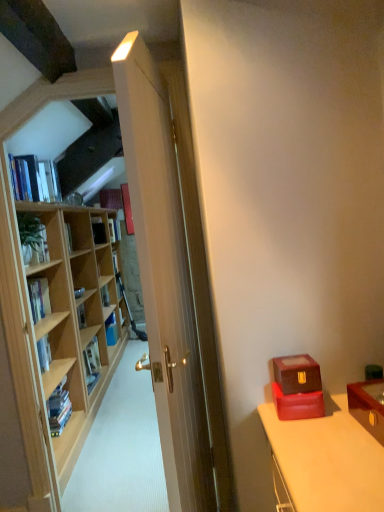
What is the approximate width of hardcover book at center, the second book when ordered from back to front?

hardcover book at center, the second book when ordered from back to front, is 5.29 inches in width.

In order to face wooden chest at right, should I rotate leftwards or rightwards?

You should rotate right by 26.894 degrees.

Describe the element at coordinates (297, 374) in the screenshot. I see `brown leather box at right, which ranks as the 2th box in bottom-to-top order` at that location.

What do you see at coordinates (32, 238) in the screenshot? The image size is (384, 512). I see `green leafy plant at left` at bounding box center [32, 238].

Find the location of a particular element. This screenshot has width=384, height=512. hardcover book at left, arranged as the sixth book when viewed from the back is located at coordinates (79, 292).

Considering the positions of point (30, 88) and point (75, 294), is point (30, 88) closer or farther from the camera than point (75, 294)?

Point (30, 88) is closer to the camera than point (75, 294).

Considering the relative sizes of light wood shelf at left and hardcover book at left, arranged as the sixth book when viewed from the back, in the image provided, is light wood shelf at left smaller than hardcover book at left, arranged as the sixth book when viewed from the back,?

Incorrect, light wood shelf at left is not smaller in size than hardcover book at left, arranged as the sixth book when viewed from the back.

Measure the distance between light wood shelf at left and hardcover book at left, which appears as the fifth book when viewed from the front.

The distance of light wood shelf at left from hardcover book at left, which appears as the fifth book when viewed from the front, is 33.32 inches.

In terms of width, does green leafy plant at left look wider or thinner when compared to hardcover book at left, arranged as the sixth book when viewed from the back?

In the image, green leafy plant at left appears to be wider than hardcover book at left, arranged as the sixth book when viewed from the back.

Is green leafy plant at left turned away from hardcover book at left, which appears as the fifth book when viewed from the front?

No, green leafy plant at left's orientation is not away from hardcover book at left, which appears as the fifth book when viewed from the front.

Is green leafy plant at left in front of hardcover book at left, which appears as the fifth book when viewed from the front?

Yes, green leafy plant at left is closer to the camera.

Is hardcover book at left, which is the second book in front-to-back order, not inside hardcover book at left, the third book viewed from the back?

Absolutely, hardcover book at left, which is the second book in front-to-back order, is external to hardcover book at left, the third book viewed from the back.

Is point (31, 298) farther from camera compared to point (98, 228)?

No, (31, 298) is in front of (98, 228).

Between hardcover book at left, placed as the ninth book when sorted from back to front, and hardcover book at left, the third book viewed from the back, which one appears on the right side from the viewer's perspective?

Positioned to the right is hardcover book at left, the third book viewed from the back.

Considering the relative positions of wooden chest at right and hardcover book at left, acting as the 8th book starting from the front, in the image provided, is wooden chest at right to the right of hardcover book at left, acting as the 8th book starting from the front, from the viewer's perspective?

Yes, wooden chest at right is to the right of hardcover book at left, acting as the 8th book starting from the front.

Which of these two, wooden chest at right or hardcover book at left, acting as the 8th book starting from the front, is smaller?

Smaller between the two is hardcover book at left, acting as the 8th book starting from the front.

Can you confirm if wooden chest at right is wider than hardcover book at left, the third book viewed from the back?

Indeed, wooden chest at right has a greater width compared to hardcover book at left, the third book viewed from the back.

Is point (360, 403) behind point (100, 240)?

No, it is in front of (100, 240).

Is matte brown box at right, the second box positioned from the top, spatially inside green matte plant at left, the 7th book in the back-to-front sequence, or outside of it?

matte brown box at right, the second box positioned from the top, is spatially situated outside green matte plant at left, the 7th book in the back-to-front sequence.

Considering the points (284, 403) and (39, 229), which point is behind, point (284, 403) or point (39, 229)?

Positioned behind is point (39, 229).

Is matte brown box at right, which is the first box from bottom to top, not near green matte plant at left, the 7th book in the back-to-front sequence?

matte brown box at right, which is the first box from bottom to top, is far away from green matte plant at left, the 7th book in the back-to-front sequence.

How far apart are matte brown box at right, the second box positioned from the top, and green matte plant at left, the 4th book from the front?

matte brown box at right, the second box positioned from the top, and green matte plant at left, the 4th book from the front, are 5.75 feet apart from each other.

I want to click on shelf directly beneath the wooden bookshelf at left, arranged as the 6th book when viewed from the front (from a real-world perspective), so click(50, 322).

In the scene shown: From a real-world perspective, who is located higher, wooden bookshelf at left, the fifth book when ordered from back to front, or light wood shelf at left?

wooden bookshelf at left, the fifth book when ordered from back to front.

Are wooden bookshelf at left, arranged as the 6th book when viewed from the front, and light wood shelf at left located far from each other?

No.

Consider the image. Between wooden bookshelf at left, the fifth book when ordered from back to front, and light wood shelf at left, which one has smaller size?

Smaller between the two is wooden bookshelf at left, the fifth book when ordered from back to front.

Is there a large distance between hardcover book at left, which is the 8th book from back to front, and wooden bookshelf at left, the fifth book when ordered from back to front?

hardcover book at left, which is the 8th book from back to front, is positioned a significant distance from wooden bookshelf at left, the fifth book when ordered from back to front.

From the image's perspective, is hardcover book at left, which is the 8th book from back to front, located above or below wooden bookshelf at left, arranged as the 6th book when viewed from the front?

hardcover book at left, which is the 8th book from back to front, is situated lower than wooden bookshelf at left, arranged as the 6th book when viewed from the front, in the image.

Who is shorter, hardcover book at left, which is the 8th book from back to front, or wooden bookshelf at left, arranged as the 6th book when viewed from the front?

With less height is wooden bookshelf at left, arranged as the 6th book when viewed from the front.

Identify the location of the 1st book positioned above the light wood shelf at left (from the image's perspective). Image resolution: width=384 pixels, height=512 pixels. (79, 292).

From the green leafy plant at left, count 5th books backward and point to it. Please provide its 2D coordinates.

[(79, 292)]

Based on their spatial positions, is hardcover book at left, acting as the 8th book starting from the front, or blue glossy book at left, which ranks as the fourth book in back-to-front order, closer to light wood shelf at left?

The object closer to light wood shelf at left is blue glossy book at left, which ranks as the fourth book in back-to-front order.

Considering their positions, is white wooden door at center positioned further to hardcover book at left, placed as the ninth book when sorted from back to front, than hardcover book at left, arranged as the sixth book when viewed from the back?

Among the two, white wooden door at center is located further to hardcover book at left, placed as the ninth book when sorted from back to front.

Looking at the image, which one is located further to white wooden door at center, wooden bookshelf at left, arranged as the 6th book when viewed from the front, or blue glossy book at left, which is the seventh book from front to back?

Based on the image, blue glossy book at left, which is the seventh book from front to back, appears to be further to white wooden door at center.

When comparing their distances from blue glossy book at left, which ranks as the fourth book in back-to-front order, does wooden bookshelf at left, the fifth book when ordered from back to front, or light wood shelf at left seem closer?

The object closer to blue glossy book at left, which ranks as the fourth book in back-to-front order, is light wood shelf at left.

Looking at this image, based on their spatial positions, is green matte plant at left, the 7th book in the back-to-front sequence, or hardcover book at left, the third book viewed from the back, closer to hardcover book at left, placed as the ninth book when sorted from back to front?

The object closer to hardcover book at left, placed as the ninth book when sorted from back to front, is green matte plant at left, the 7th book in the back-to-front sequence.

Considering their positions, is hardcover book at left, which appears as the 3th book when viewed from the front, positioned closer to light wood shelf at left than hardcover book at left, arranged as the sixth book when viewed from the back?

hardcover book at left, which appears as the 3th book when viewed from the front, lies closer to light wood shelf at left than the other object.

When comparing their distances from hardcover book at left, arranged as the sixth book when viewed from the back, does wooden chest at right or hardcover book at center, arranged as the first book when viewed from the back, seem closer?

Based on the image, hardcover book at center, arranged as the first book when viewed from the back, appears to be nearer to hardcover book at left, arranged as the sixth book when viewed from the back.

Based on their spatial positions, is hardcover book at center, the second book when ordered from back to front, or brown leather box at right, placed as the 1th box when sorted from top to bottom, closer to green matte plant at left, the 7th book in the back-to-front sequence?

hardcover book at center, the second book when ordered from back to front, is closer to green matte plant at left, the 7th book in the back-to-front sequence.

Locate an element on the screen. The width and height of the screenshot is (384, 512). book between white wooden door at center and hardcover book at left, which is the second book in front-to-back order, in the front-back direction is located at coordinates (42, 178).

Identify the location of box located between matte brown box at right, which is the first box from bottom to top, and green matte plant at left, the 7th book in the back-to-front sequence, in the depth direction. Image resolution: width=384 pixels, height=512 pixels. (297, 374).

You are a GUI agent. You are given a task and a screenshot of the screen. Output one action in this format:
    pyautogui.click(x=<x>, y=<y>)
    Task: Click on the houseplant between hardcover books at left, marked as the first book in a front-to-back arrangement, and hardcover book at left, which is the second book in front-to-back order, in the up-down direction
    
    Given the screenshot: What is the action you would take?
    click(x=32, y=238)

Where is `shelf between white wooden door at center and green leafy plant at left from front to back`? This screenshot has width=384, height=512. shelf between white wooden door at center and green leafy plant at left from front to back is located at coordinates (50, 322).